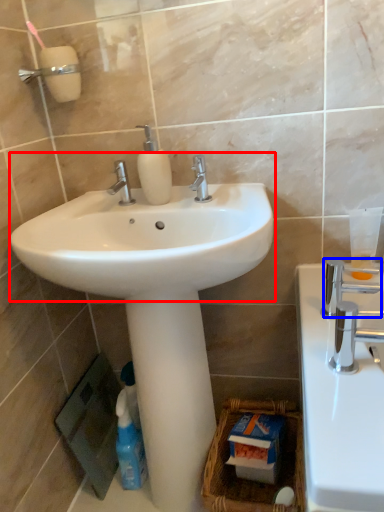
Question: Which object appears closest to the camera in this image, sink (highlighted by a red box) or plumbing fixture (highlighted by a blue box)?

Choices:
 (A) sink
 (B) plumbing fixture

Answer: (A)